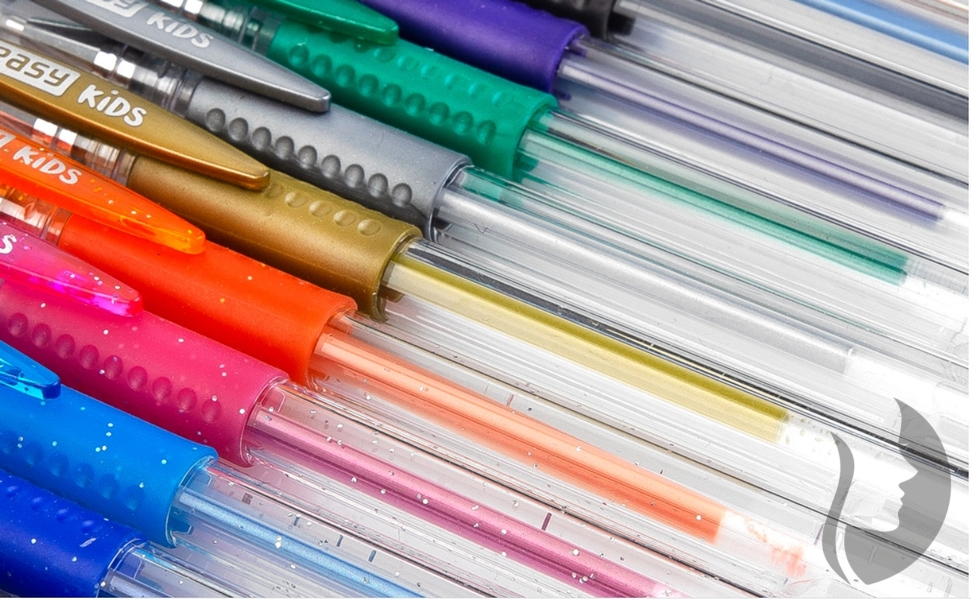
The width and height of the screenshot is (971, 600). I want to click on clear plastic cylinder shaped pen bodies, so click(x=155, y=581), click(x=241, y=515), click(x=330, y=463), click(x=430, y=395), click(x=499, y=350), click(x=556, y=269), click(x=552, y=162), click(x=633, y=115), click(x=714, y=49), click(x=888, y=49).